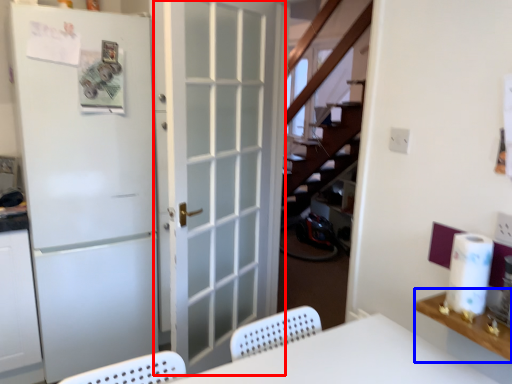
Question: Which of the following is the closest to the observer, door (highlighted by a red box) or counter top (highlighted by a blue box)?

Choices:
 (A) door
 (B) counter top

Answer: (B)